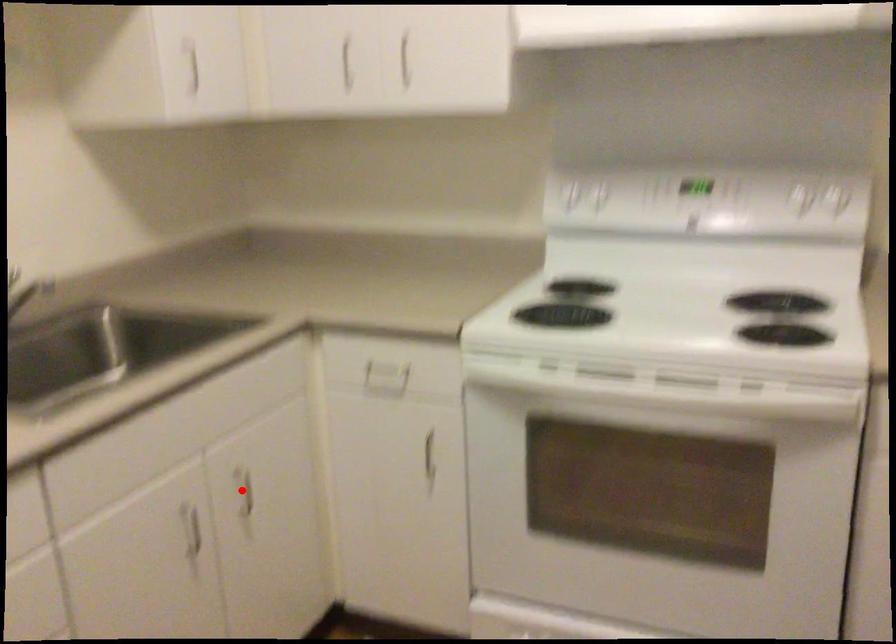
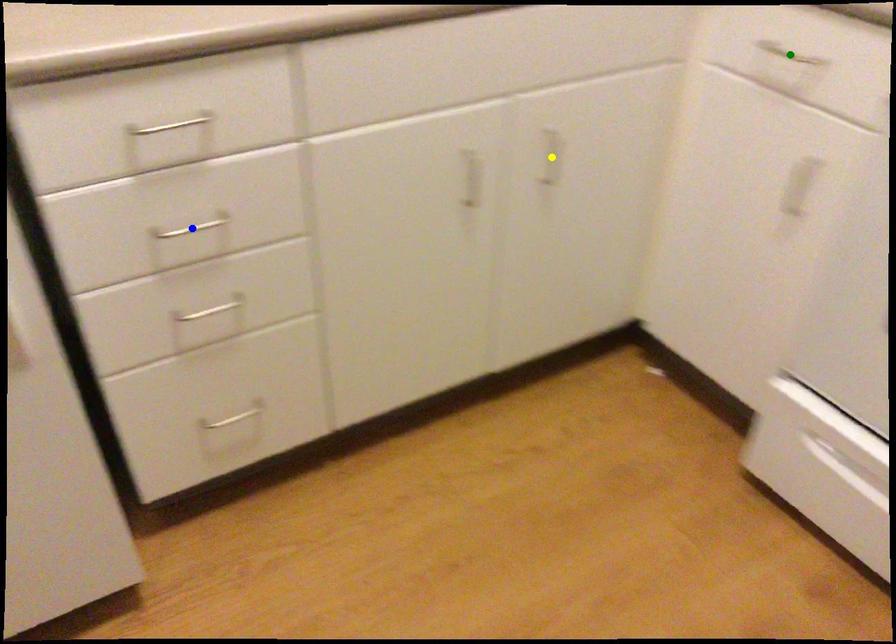
Question: I am providing you with two images of the same scene from different viewpoints. A red point is marked on the first image. You are given multiple points on the second image. Which point in image 2 is actually the same real-world point as the red point in image 1?

Choices:
 (A) yellow point
 (B) green point
 (C) blue point

Answer: (A)